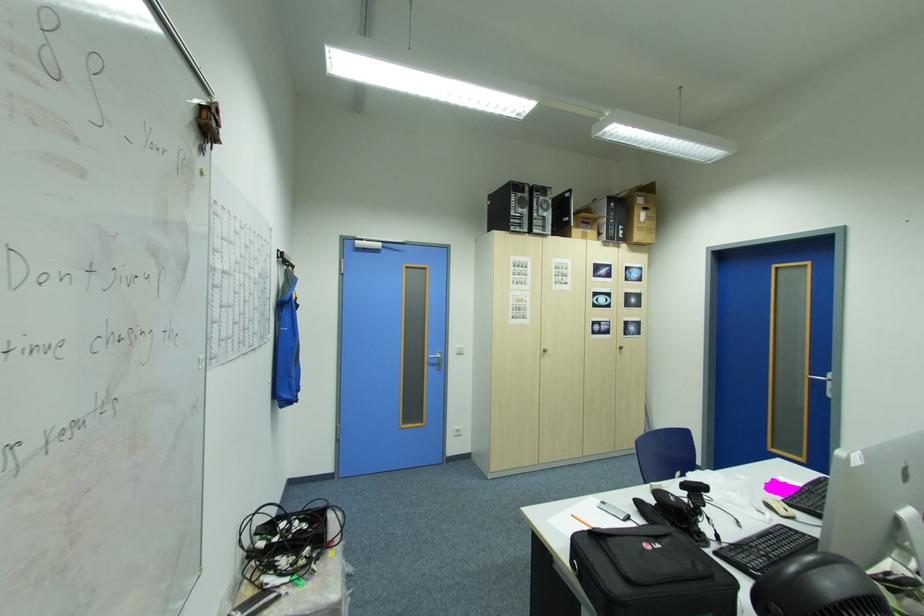
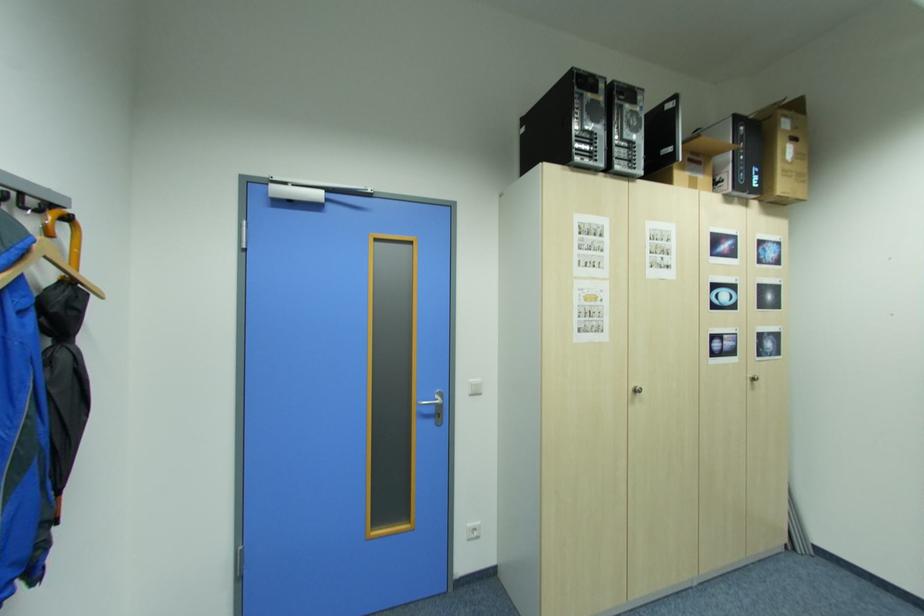
The point at (462, 429) is marked in the first image. Where is the corresponding point in the second image?

(476, 529)